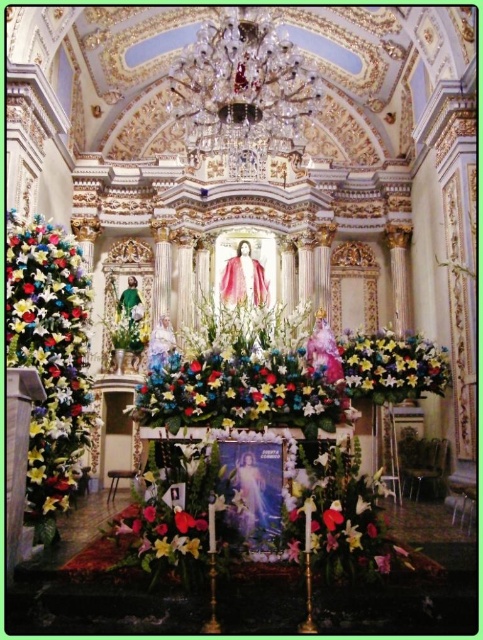
Question: Is the position of floral bouquet at left less distant than that of floral arrangement at center?

Choices:
 (A) no
 (B) yes

Answer: (B)

Question: Which point is farther from the camera taking this photo?

Choices:
 (A) (444, 385)
 (B) (65, 257)

Answer: (A)

Question: Can you confirm if floral bouquet at left is bigger than floral bouquet at right?

Choices:
 (A) yes
 (B) no

Answer: (A)

Question: Considering the real-world distances, which object is farthest from the floral bouquet at left?

Choices:
 (A) floral bouquet at right
 (B) floral arrangement at center

Answer: (A)

Question: Which object appears closest to the camera in this image?

Choices:
 (A) floral bouquet at right
 (B) floral arrangement at center
 (C) floral bouquet at left

Answer: (C)

Question: Can you confirm if floral bouquet at left is smaller than floral arrangement at center?

Choices:
 (A) yes
 (B) no

Answer: (B)